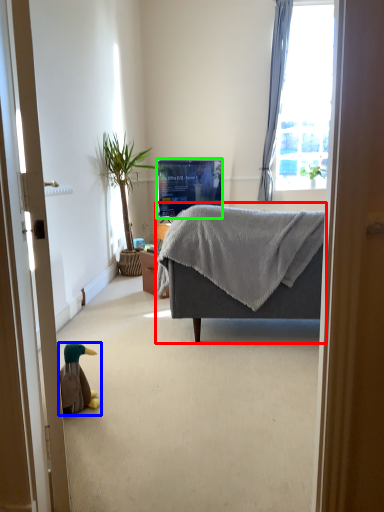
Question: Which is farther away from studio couch (highlighted by a red box)? animal (highlighted by a blue box) or television (highlighted by a green box)?

Choices:
 (A) animal
 (B) television

Answer: (B)